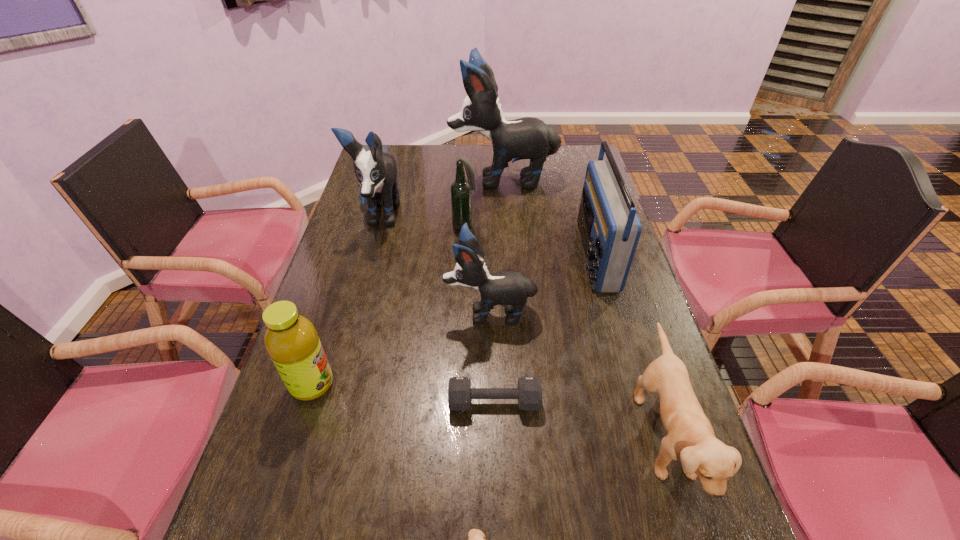
Locate an element on the screen. vacant region located on the front-facing side of the third nearest puppy is located at coordinates (345, 312).

Where is `free point located 0.200m on the front-facing side of the third nearest puppy`? The width and height of the screenshot is (960, 540). free point located 0.200m on the front-facing side of the third nearest puppy is located at coordinates (371, 312).

In order to click on free region located on the front-facing side of the third nearest puppy in this screenshot , I will do `click(427, 312)`.

Where is `vacant region located 0.200m on the front of the beer bottle`? Image resolution: width=960 pixels, height=540 pixels. vacant region located 0.200m on the front of the beer bottle is located at coordinates (463, 274).

Locate an element on the screen. This screenshot has width=960, height=540. vacant space located 0.080m on the front label of the fruit juice is located at coordinates (369, 384).

Where is `free location located on the left side of the third shortest object`? free location located on the left side of the third shortest object is located at coordinates [x=468, y=435].

You are a GUI agent. You are given a task and a screenshot of the screen. Output one action in this format:
    pyautogui.click(x=<x>, y=<y>)
    Task: Click on the vacant region located on the left side of the third shortest object
    This screenshot has width=960, height=540.
    Given the screenshot: What is the action you would take?
    pyautogui.click(x=588, y=435)

Locate an element on the screen. The image size is (960, 540). vacant space positioned 0.250m on the left side of the third shortest object is located at coordinates (521, 435).

Where is `blank area located 0.160m on the back of the gray dumbbell`? The image size is (960, 540). blank area located 0.160m on the back of the gray dumbbell is located at coordinates (492, 334).

You are a GUI agent. You are given a task and a screenshot of the screen. Output one action in this format:
    pyautogui.click(x=<x>, y=<y>)
    Task: Click on the object situated at the far edge
    
    Given the screenshot: What is the action you would take?
    pyautogui.click(x=530, y=138)